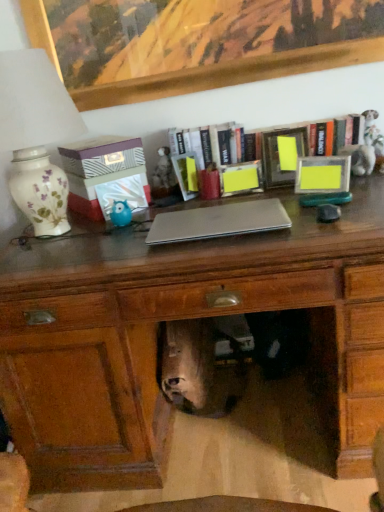
Question: From a real-world perspective, is wooden bookshelf at upper center above or below matte blue plastic owl at center-left?

Choices:
 (A) above
 (B) below

Answer: (A)

Question: Based on their sizes in the image, would you say wooden bookshelf at upper center is bigger or smaller than matte blue plastic owl at center-left?

Choices:
 (A) big
 (B) small

Answer: (A)

Question: Considering the real-world distances, which object is closest to the matte wooden desk at center?

Choices:
 (A) shiny silver skull at center
 (B) wooden picture frame at upper center, the second picture frame viewed from the right
 (C) wooden bookshelf at upper center
 (D) white floral ceramic lamp at left
 (E) matte yellow picture frame at right, the 2th picture frame viewed from the top

Answer: (A)

Question: Based on their relative distances, which object is nearer to the matte blue plastic owl at center-left?

Choices:
 (A) shiny silver skull at center
 (B) wooden bookshelf at upper center
 (C) matte yellow picture frame at right, arranged as the 1th picture frame when ordered from the bottom
 (D) wooden picture frame at upper center, the first picture frame in the left-to-right sequence
 (E) white floral ceramic lamp at left

Answer: (E)